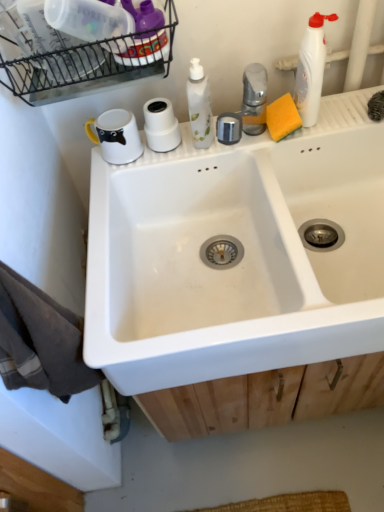
Question: Is white matte toilet paper at upper center with black wire basket at upper left?

Choices:
 (A) yes
 (B) no

Answer: (B)

Question: Are white matte toilet paper at upper center and black wire basket at upper left located far from each other?

Choices:
 (A) yes
 (B) no

Answer: (B)

Question: From the image's perspective, is white matte toilet paper at upper center located beneath black wire basket at upper left?

Choices:
 (A) no
 (B) yes

Answer: (B)

Question: Is white matte toilet paper at upper center to the left of black wire basket at upper left from the viewer's perspective?

Choices:
 (A) yes
 (B) no

Answer: (B)

Question: Is white matte toilet paper at upper center not within black wire basket at upper left?

Choices:
 (A) yes
 (B) no

Answer: (A)

Question: Is black wire basket at upper left to the left or to the right of yellow sponge at upper right in the image?

Choices:
 (A) right
 (B) left

Answer: (B)

Question: Is point (59, 84) positioned closer to the camera than point (291, 113)?

Choices:
 (A) farther
 (B) closer

Answer: (B)

Question: Looking at their shapes, would you say black wire basket at upper left is wider or thinner than yellow sponge at upper right?

Choices:
 (A) wide
 (B) thin

Answer: (A)

Question: Which is correct: black wire basket at upper left is inside yellow sponge at upper right, or outside of it?

Choices:
 (A) inside
 (B) outside

Answer: (B)

Question: Is black wire basket at upper left wider or thinner than white matte toilet paper at upper center?

Choices:
 (A) thin
 (B) wide

Answer: (B)

Question: Is black wire basket at upper left taller or shorter than white matte toilet paper at upper center?

Choices:
 (A) short
 (B) tall

Answer: (B)

Question: Is point (43, 91) positioned closer to the camera than point (147, 129)?

Choices:
 (A) closer
 (B) farther

Answer: (A)

Question: Would you say black wire basket at upper left is to the left or to the right of white matte toilet paper at upper center in the picture?

Choices:
 (A) left
 (B) right

Answer: (A)

Question: In terms of height, does white ceramic sink at center look taller or shorter compared to white matte toilet paper at upper center?

Choices:
 (A) short
 (B) tall

Answer: (B)

Question: From the image's perspective, is white ceramic sink at center above or below white matte toilet paper at upper center?

Choices:
 (A) below
 (B) above

Answer: (A)